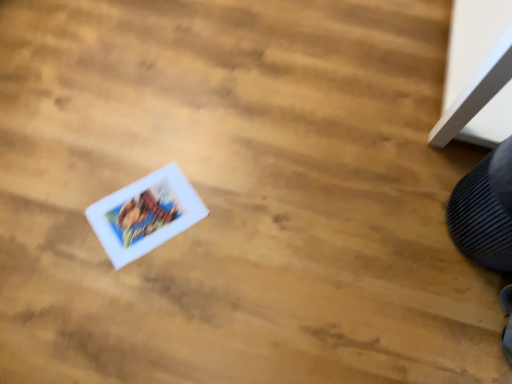
What are the coordinates of `free spot to the left of white matte comic book at center` in the screenshot? It's located at (69, 205).